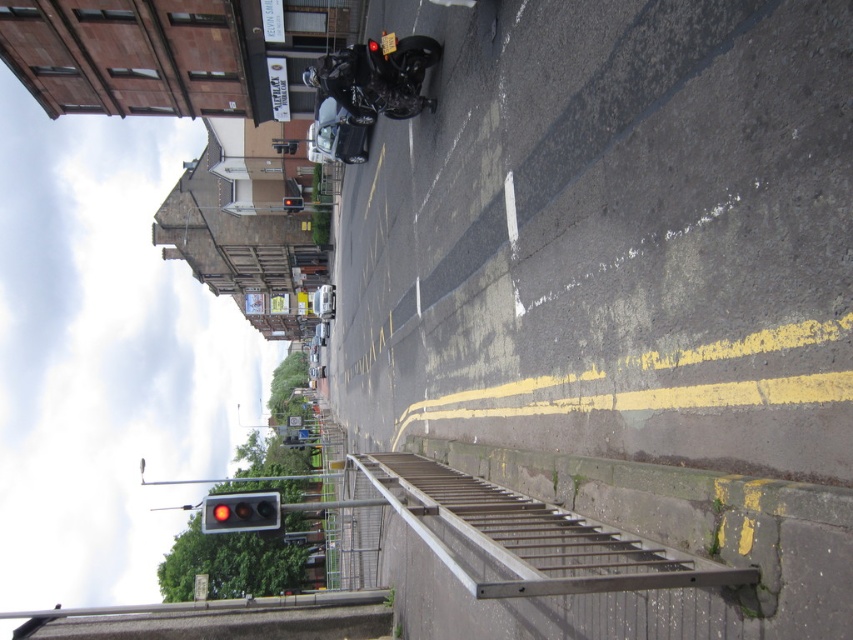
You are standing on the sidewalk and see the red glass traffic light at lower left. Where exactly is it located in terms of coordinates?

The red glass traffic light at lower left is located at coordinates point (241, 513).

You are a delivery person who needs to know which traffic light is taller to determine the correct lane. Given that both are labeled as red glass traffic light at lower left and red glass traffic light at center, which one is taller?

The red glass traffic light at lower left is taller than the red glass traffic light at center.